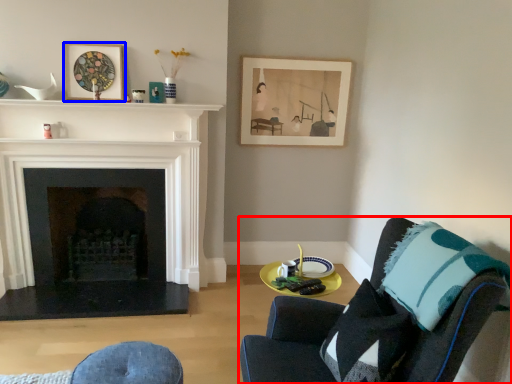
Question: Among these objects, which one is farthest to the camera, chair (highlighted by a red box) or picture frame (highlighted by a blue box)?

Choices:
 (A) chair
 (B) picture frame

Answer: (B)